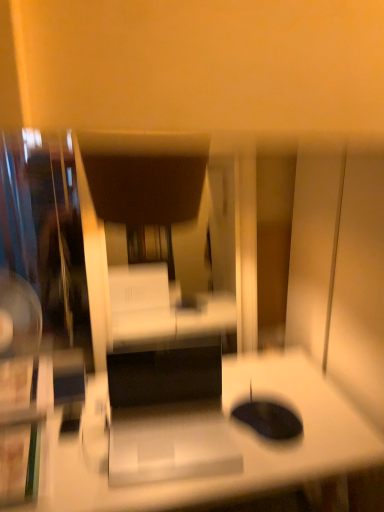
Question: Looking at their shapes, would you say white glossy desk at center is wider or thinner than dark brown leather swivel chair at center?

Choices:
 (A) thin
 (B) wide

Answer: (B)

Question: In the image, is white glossy desk at center on the left side or the right side of dark brown leather swivel chair at center?

Choices:
 (A) left
 (B) right

Answer: (B)

Question: Considering the positions of white glossy desk at center and dark brown leather swivel chair at center in the image, is white glossy desk at center taller or shorter than dark brown leather swivel chair at center?

Choices:
 (A) tall
 (B) short

Answer: (A)

Question: In terms of size, does dark brown leather swivel chair at center appear bigger or smaller than white glossy desk at center?

Choices:
 (A) big
 (B) small

Answer: (B)

Question: Is dark brown leather swivel chair at center to the left or to the right of white glossy desk at center in the image?

Choices:
 (A) right
 (B) left

Answer: (B)

Question: Is point (183, 176) positioned closer to the camera than point (41, 458)?

Choices:
 (A) closer
 (B) farther

Answer: (B)

Question: From a real-world perspective, is dark brown leather swivel chair at center physically located above or below white glossy desk at center?

Choices:
 (A) below
 (B) above

Answer: (B)